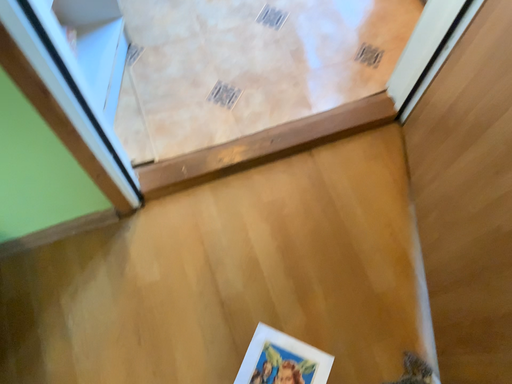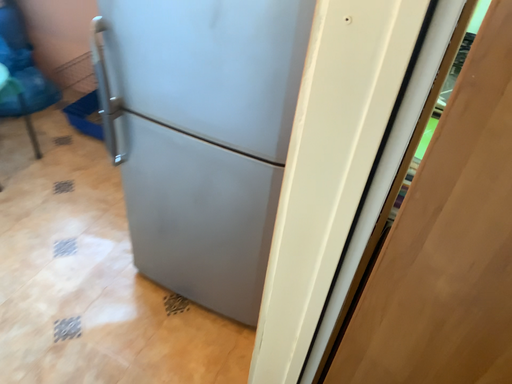
Question: How did the camera likely rotate when shooting the video?

Choices:
 (A) rotated upward
 (B) rotated downward

Answer: (A)